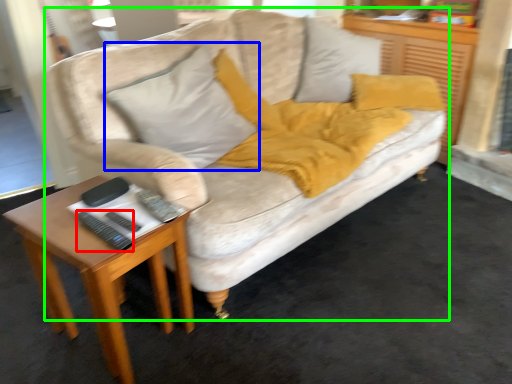
Question: Which object is the farthest from remote (highlighted by a red box)? Choose among these: throw pillow (highlighted by a blue box) or studio couch (highlighted by a green box).

Choices:
 (A) throw pillow
 (B) studio couch

Answer: (B)